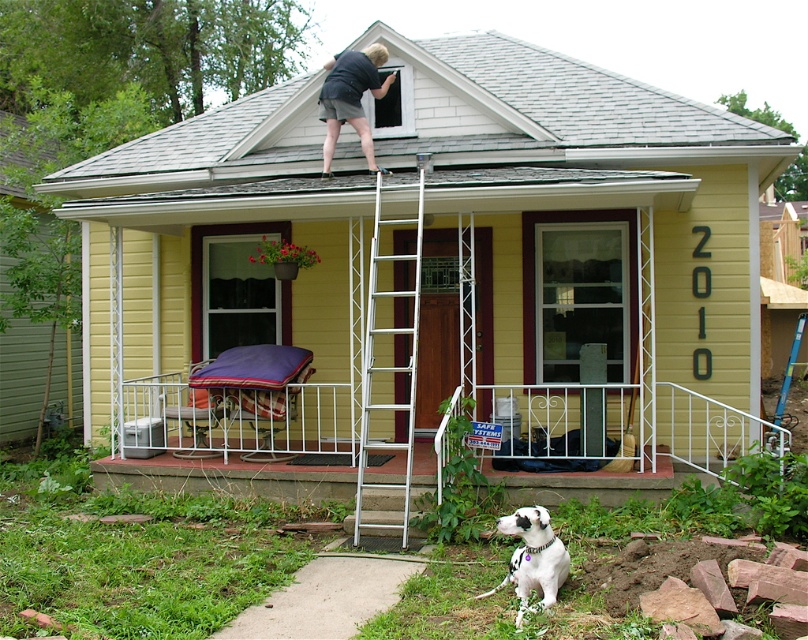
Between dark blue shirt at upper center and white-spotted fur dog at lower right, which one appears on the left side from the viewer's perspective?

dark blue shirt at upper center

You are a GUI agent. You are given a task and a screenshot of the screen. Output one action in this format:
    pyautogui.click(x=<x>, y=<y>)
    Task: Click on the dark blue shirt at upper center
    This screenshot has width=808, height=640.
    Given the screenshot: What is the action you would take?
    pyautogui.click(x=351, y=99)

Identify the location of dark blue shirt at upper center. tap(351, 99).

Between white metal railing at lower center and dark blue shirt at upper center, which one is positioned lower?

white metal railing at lower center is lower down.

You are a GUI agent. You are given a task and a screenshot of the screen. Output one action in this format:
    pyautogui.click(x=<x>, y=<y>)
    Task: Click on the white metal railing at lower center
    
    Given the screenshot: What is the action you would take?
    pyautogui.click(x=638, y=436)

Locate an element on the screen. This screenshot has width=808, height=640. white metal railing at lower center is located at coordinates (638, 436).

Which of these two, white metal railing at lower center or white-spotted fur dog at lower right, stands taller?

white metal railing at lower center is taller.

Is white metal railing at lower center below white-spotted fur dog at lower right?

No.

Is point (687, 470) closer to camera compared to point (537, 556)?

No, it is not.

The height and width of the screenshot is (640, 808). Identify the location of white metal railing at lower center. (638, 436).